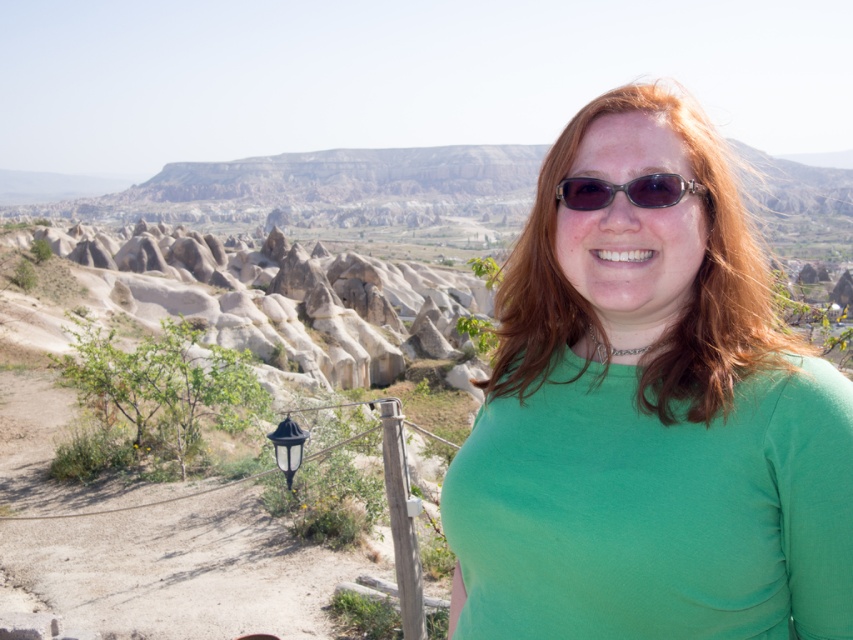
You are a photographer trying to capture a closeup shot of the green matte shirt at center and the brown textured sunglasses at center in the image. Given that your camera has a maximum focus range of 30 feet, will you be able to capture both objects in focus at the same time?

The green matte shirt at center and brown textured sunglasses at center are 35.60 feet apart from each other. Since the distance between them exceeds the camera maximum focus range of 30 feet, you won exceed the focus range and won be able to capture both in focus simultaneously.

You are a photographer taking a portrait of the person in the scene. You want to ensure that both the green matte shirt at center and the brown textured sunglasses at center are clearly visible. Based on their positions, which object should you focus on first to ensure both are in focus?

The green matte shirt at center is positioned under the brown textured sunglasses at center. To ensure both are in focus, you should focus on the brown textured sunglasses at center first since it is closer to the camera, and the shirt is behind it. This way, the depth of field will cover both objects.